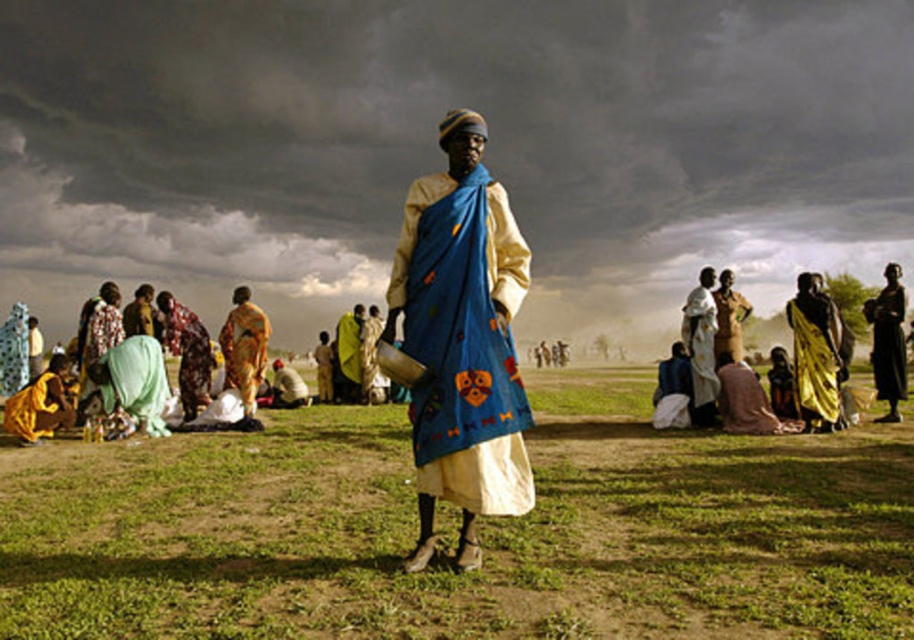
Question: Does golden-yellow fabric at right have a smaller size compared to brown textured cloth at lower right?

Choices:
 (A) no
 (B) yes

Answer: (A)

Question: Is black matte dress at right to the left of yellow fabric bag at center from the viewer's perspective?

Choices:
 (A) yes
 (B) no

Answer: (B)

Question: Which object is the farthest from the green grass at center?

Choices:
 (A) yellow-orange fabric at center
 (B) brown textured cloth at lower right
 (C) blue fabric cloth at center
 (D) yellow fabric bag at center

Answer: (D)

Question: Estimate the real-world distances between objects in this image. Which object is farther from the blue fabric cloth at center?

Choices:
 (A) yellow-orange fabric at center
 (B) yellow fabric bag at center

Answer: (B)

Question: Among these objects, which one is farthest from the camera?

Choices:
 (A) yellow-orange fabric at center
 (B) blue fabric cloth at center
 (C) matte yellow fabric at center

Answer: (C)

Question: Is black matte dress at right above yellow fabric bag at center?

Choices:
 (A) yes
 (B) no

Answer: (B)